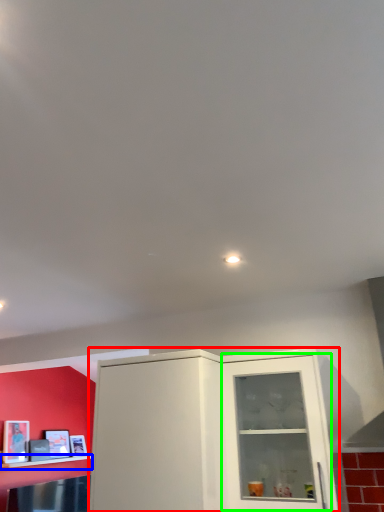
Question: Which is farther away from cabinetry (highlighted by a red box)? shelf (highlighted by a blue box) or glass door (highlighted by a green box)?

Choices:
 (A) shelf
 (B) glass door

Answer: (A)